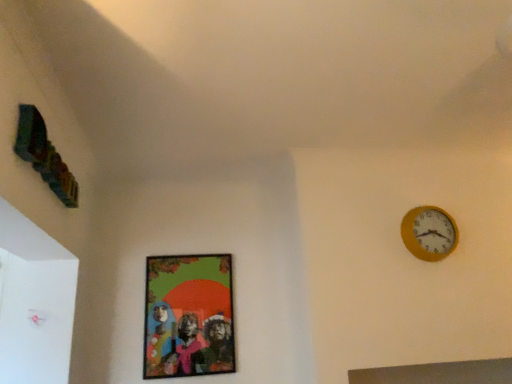
Question: Is yellow wooden clock at upper right facing away from matte plastic picture frame at center?

Choices:
 (A) no
 (B) yes

Answer: (A)

Question: Is yellow wooden clock at upper right closer to the viewer compared to matte plastic picture frame at center?

Choices:
 (A) yes
 (B) no

Answer: (A)

Question: Is yellow wooden clock at upper right to the right of matte plastic picture frame at center from the viewer's perspective?

Choices:
 (A) yes
 (B) no

Answer: (A)

Question: Considering the relative positions of yellow wooden clock at upper right and matte plastic picture frame at center in the image provided, is yellow wooden clock at upper right behind matte plastic picture frame at center?

Choices:
 (A) no
 (B) yes

Answer: (A)

Question: Is yellow wooden clock at upper right outside of matte plastic picture frame at center?

Choices:
 (A) yes
 (B) no

Answer: (A)

Question: Is yellow wooden clock at upper right shorter than matte plastic picture frame at center?

Choices:
 (A) yes
 (B) no

Answer: (A)

Question: Can you confirm if matte plastic picture frame at center is wider than yellow wooden clock at upper right?

Choices:
 (A) yes
 (B) no

Answer: (B)

Question: Is matte plastic picture frame at center facing towards yellow wooden clock at upper right?

Choices:
 (A) no
 (B) yes

Answer: (A)

Question: Is matte plastic picture frame at center not inside yellow wooden clock at upper right?

Choices:
 (A) yes
 (B) no

Answer: (A)

Question: Does matte plastic picture frame at center have a larger size compared to yellow wooden clock at upper right?

Choices:
 (A) no
 (B) yes

Answer: (B)

Question: Can you confirm if matte plastic picture frame at center is taller than yellow wooden clock at upper right?

Choices:
 (A) no
 (B) yes

Answer: (B)

Question: Are matte plastic picture frame at center and yellow wooden clock at upper right far apart?

Choices:
 (A) yes
 (B) no

Answer: (A)

Question: Based on their positions, is matte plastic picture frame at center located to the left or right of yellow wooden clock at upper right?

Choices:
 (A) right
 (B) left

Answer: (B)